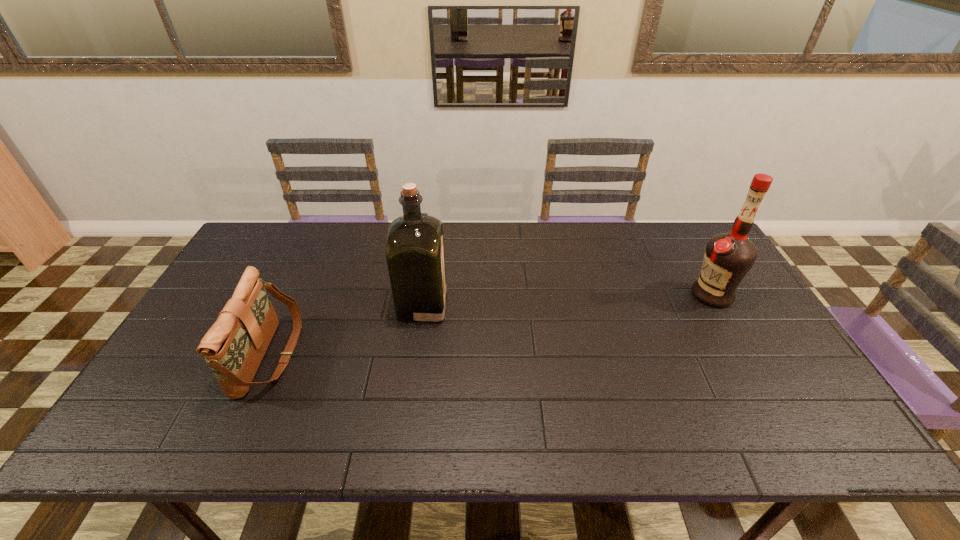
Locate an element on the screen. unoccupied area between the right liquor and the left liquor is located at coordinates (567, 299).

Identify the location of free spot between the second object from left to right and the right liquor. (567, 299).

In order to click on unoccupied position between the leftmost object and the second object from left to right in this screenshot , I will do `click(347, 330)`.

Where is `free space between the left liquor and the rightmost object`? The image size is (960, 540). free space between the left liquor and the rightmost object is located at coordinates (567, 299).

This screenshot has height=540, width=960. I want to click on free spot between the right liquor and the shoulder bag, so click(x=491, y=325).

Find the location of a particular element. The width and height of the screenshot is (960, 540). empty space between the right liquor and the shortest object is located at coordinates (491, 325).

Locate an element on the screen. object that is the second closest to the rightmost object is located at coordinates (234, 346).

Find the location of `object that is the nearest to the shoulder bag`. object that is the nearest to the shoulder bag is located at coordinates (415, 256).